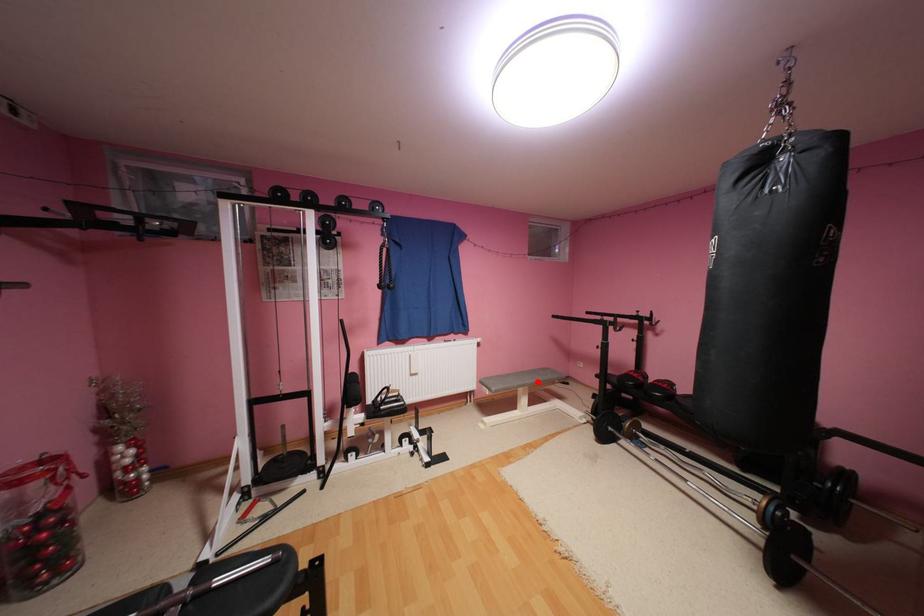
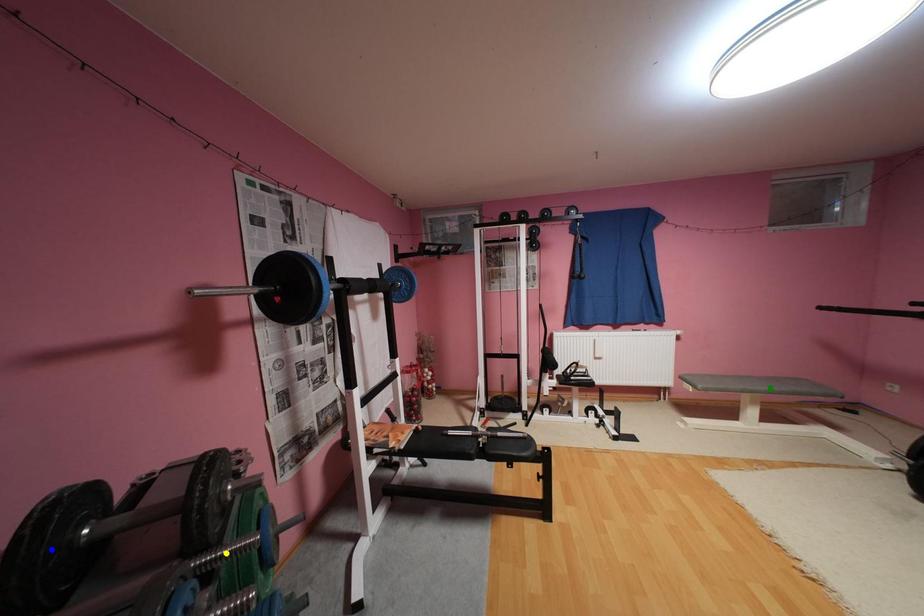
Question: I am providing you with two images of the same scene from different viewpoints. A red point is marked on the first image. You are given multiple points on the second image. Which spot in image 2 lines up with the point in image 1?

Choices:
 (A) yellow point
 (B) green point
 (C) blue point

Answer: (B)